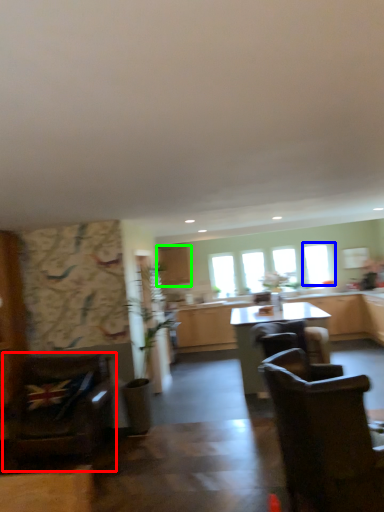
Question: Which object is the farthest from chair (highlighted by a red box)? Choose among these: window (highlighted by a blue box) or cabinetry (highlighted by a green box).

Choices:
 (A) window
 (B) cabinetry

Answer: (A)